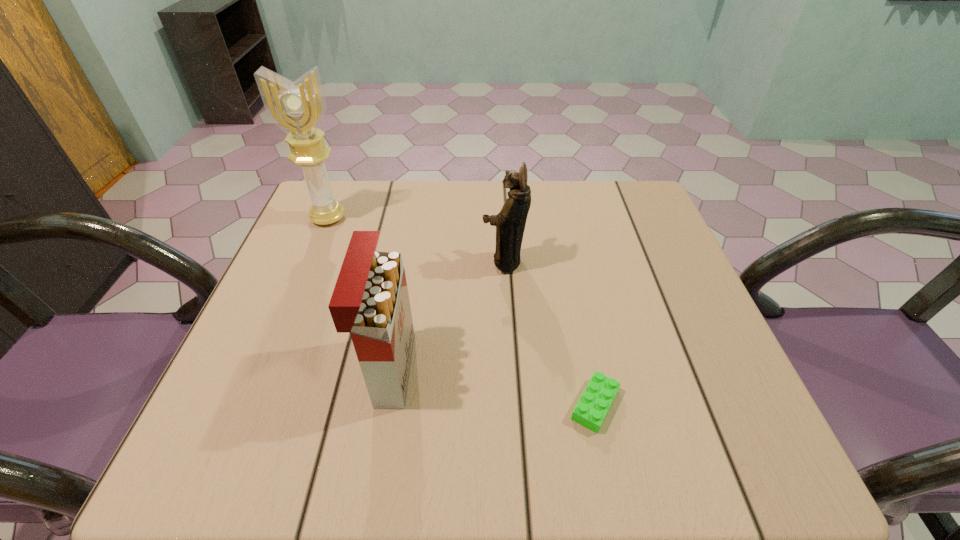
Where is `empty space between the shortest object and the cigarette case`? The width and height of the screenshot is (960, 540). empty space between the shortest object and the cigarette case is located at coordinates 492,387.

The width and height of the screenshot is (960, 540). What are the coordinates of `free space between the shortest object and the tallest object` in the screenshot? It's located at (462, 311).

I want to click on empty space that is in between the Lego and the farthest object, so click(x=462, y=311).

Select which object is the second closest to the second object from left to right. Please provide its 2D coordinates. Your answer should be formatted as a tuple, i.e. [(x, y)], where the tuple contains the x and y coordinates of a point satisfying the conditions above.

[(596, 400)]

Select which object is the closest to the leftmost object. Please provide its 2D coordinates. Your answer should be formatted as a tuple, i.e. [(x, y)], where the tuple contains the x and y coordinates of a point satisfying the conditions above.

[(510, 222)]

Where is `free spot that satisfies the following two spatial constraints: 1. on the front-facing side of the figurine; 2. on the right side of the Lego`? free spot that satisfies the following two spatial constraints: 1. on the front-facing side of the figurine; 2. on the right side of the Lego is located at coordinates (513, 405).

I want to click on free space that satisfies the following two spatial constraints: 1. on the back side of the Lego; 2. on the front-facing side of the second farthest object, so click(x=565, y=261).

At what (x,y) coordinates should I click in order to perform the action: click on vacant region that satisfies the following two spatial constraints: 1. on the front-facing side of the tallest object; 2. on the right side of the shortest object. Please return your answer as a coordinate pair (x, y). Image resolution: width=960 pixels, height=540 pixels. Looking at the image, I should click on (251, 405).

The width and height of the screenshot is (960, 540). I want to click on free region that satisfies the following two spatial constraints: 1. on the front-facing side of the second object from right to left; 2. on the left side of the rightmost object, so click(513, 405).

You are a GUI agent. You are given a task and a screenshot of the screen. Output one action in this format:
    pyautogui.click(x=<x>, y=<y>)
    Task: Click on the vacant area in the image that satisfies the following two spatial constraints: 1. on the front-facing side of the second object from right to left; 2. on the back side of the Lego
    The image size is (960, 540).
    Given the screenshot: What is the action you would take?
    pyautogui.click(x=513, y=405)